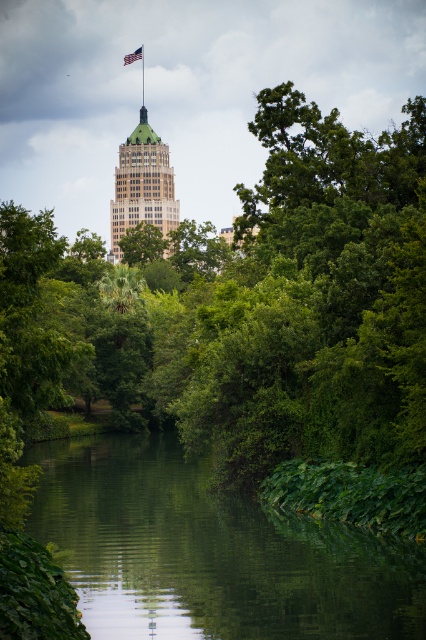
Can you confirm if green marble skyscraper at center is positioned to the left of metallic pole at upper center?

No, green marble skyscraper at center is not to the left of metallic pole at upper center.

Does green marble skyscraper at center have a greater width compared to metallic pole at upper center?

Yes, green marble skyscraper at center is wider than metallic pole at upper center.

The height and width of the screenshot is (640, 426). What do you see at coordinates (143, 186) in the screenshot?
I see `green marble skyscraper at center` at bounding box center [143, 186].

This screenshot has width=426, height=640. In order to click on green marble skyscraper at center in this screenshot , I will do `click(143, 186)`.

Between metallic pole at upper center and american flag at upper center, which one appears on the right side from the viewer's perspective?

metallic pole at upper center is more to the right.

Describe the element at coordinates (141, 72) in the screenshot. I see `metallic pole at upper center` at that location.

Which is behind, point (141, 96) or point (135, 60)?

The point (141, 96) is more distant.

The height and width of the screenshot is (640, 426). Find the location of `metallic pole at upper center`. metallic pole at upper center is located at coordinates (141, 72).

Can you confirm if green leafy tree at center is thinner than metallic pole at upper center?

No, green leafy tree at center is not thinner than metallic pole at upper center.

Which of these two, green leafy tree at center or metallic pole at upper center, stands shorter?

metallic pole at upper center

Which is in front, point (402, 227) or point (141, 49)?

Positioned in front is point (402, 227).

Identify the location of green leafy tree at center. The width and height of the screenshot is (426, 640). (316, 300).